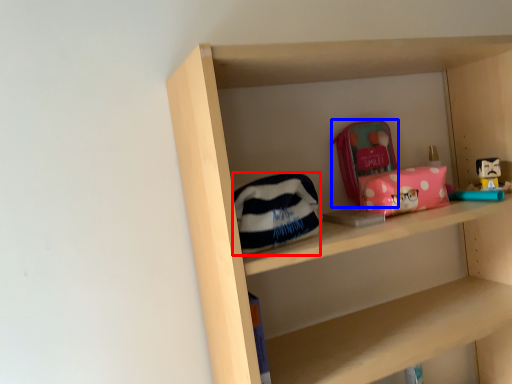
Question: Which of the following is the farthest to the observer, pouch (highlighted by a red box) or pouch (highlighted by a blue box)?

Choices:
 (A) pouch
 (B) pouch

Answer: (B)